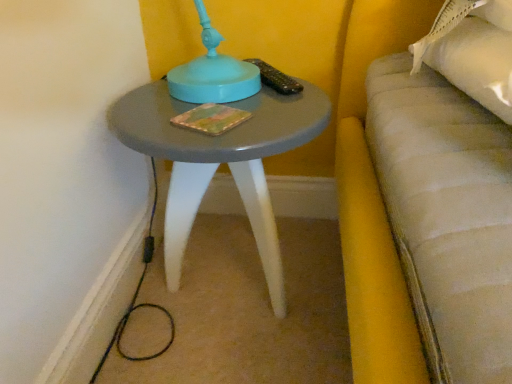
Where is `vacant space to the left of multicolored textured book at center`? This screenshot has width=512, height=384. vacant space to the left of multicolored textured book at center is located at coordinates (146, 112).